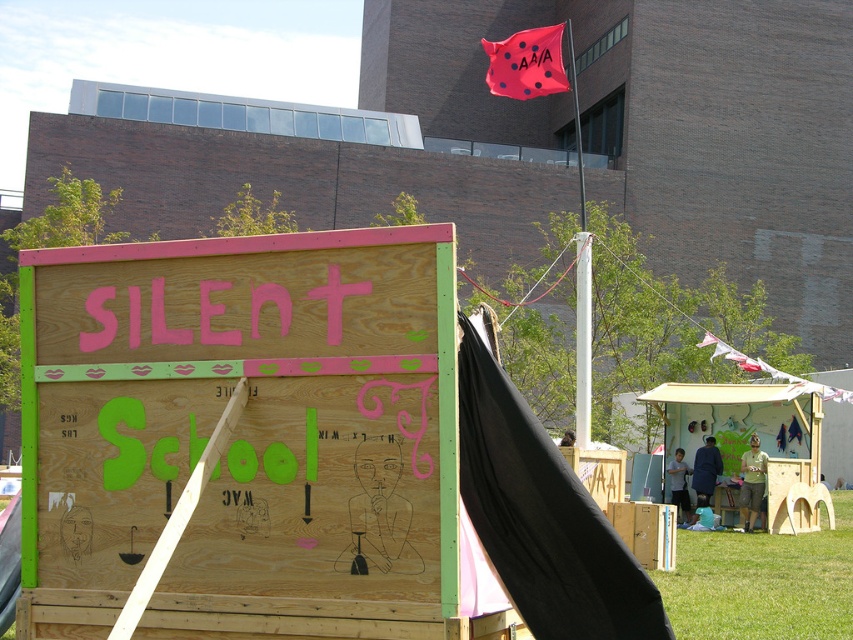
You are a photographer trying to capture both the pink fabric flag at upper center and the red fabric flag at upper right in a single shot. Based on their heights, which flag will appear larger in the photo?

The pink fabric flag at upper center is much taller than the red fabric flag at upper right, so it will appear larger in the photo.

You are standing at the origin point of the coordinate system in the image. You want to walk to the green grass at lower right. What are the coordinates you need to move to?

The coordinates for the green grass at lower right are at point (763, 582).

You are standing at the center of the image and want to locate the wooden signboard at center. What are the coordinates where you should look?

The wooden signboard at center is located at coordinates point (242, 433).